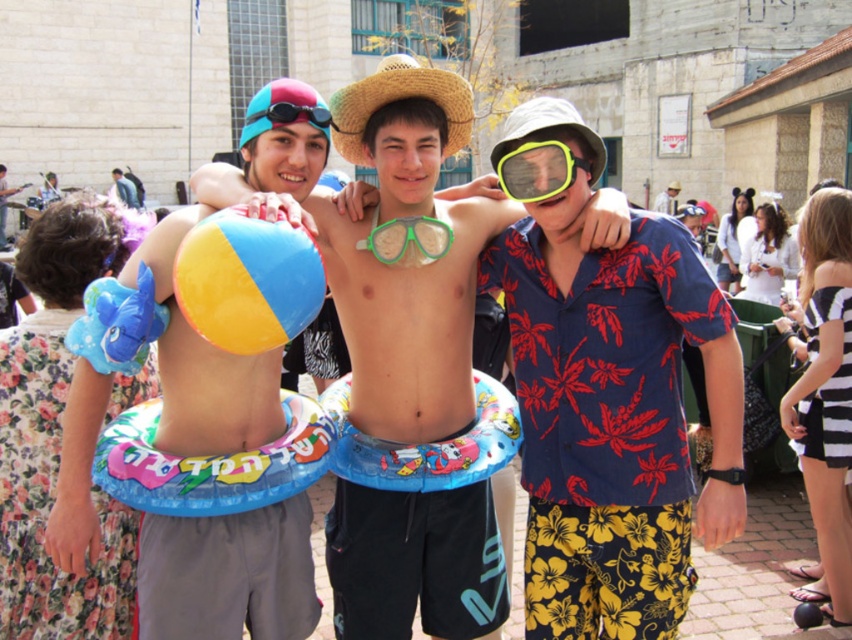
You are trying to locate the green matte snorkel mask at center in the image. According to the coordinates provided, where exactly is it positioned?

The green matte snorkel mask at center is located at point coordinates (538,170).

You are standing at the origin point of the coordinate system and want to throw a frisbee to your friend who is standing at point (407, 266). What object is located at that point?

The point (407, 266) has a matte plastic beach ball at center.